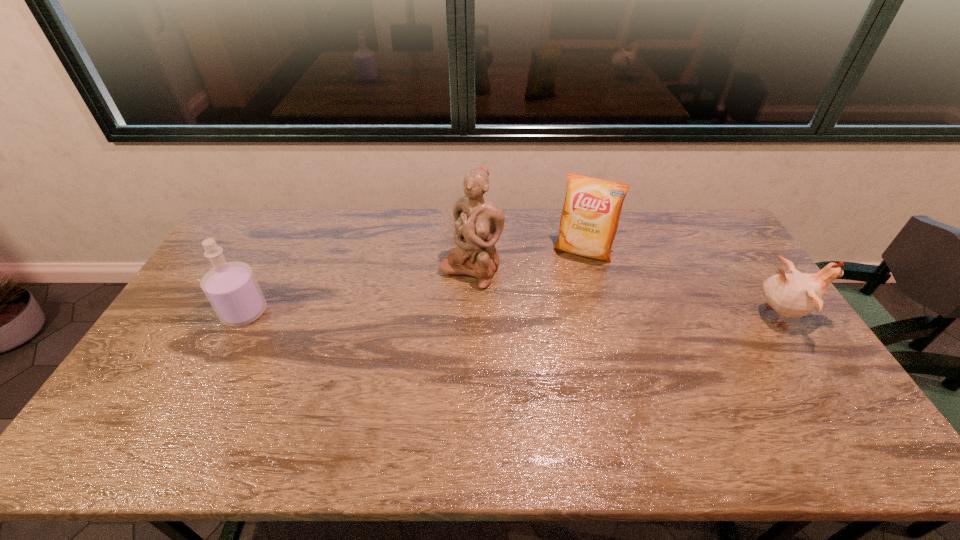
Where is `blank area at the far left corner`? blank area at the far left corner is located at coordinates (279, 218).

You are a GUI agent. You are given a task and a screenshot of the screen. Output one action in this format:
    pyautogui.click(x=<x>, y=<y>)
    Task: Click on the vacant space at the near left corner
    
    Given the screenshot: What is the action you would take?
    pyautogui.click(x=171, y=407)

The height and width of the screenshot is (540, 960). In order to click on free space at the far right corner in this screenshot , I will do `click(731, 236)`.

You are a GUI agent. You are given a task and a screenshot of the screen. Output one action in this format:
    pyautogui.click(x=<x>, y=<y>)
    Task: Click on the empty space that is in between the leftmost object and the bird
    The height and width of the screenshot is (540, 960).
    Given the screenshot: What is the action you would take?
    pyautogui.click(x=512, y=314)

The image size is (960, 540). What are the coordinates of `vacant region between the tallest object and the crisp (potato chip)` in the screenshot? It's located at (527, 261).

Where is `free spot between the bird and the crisp (potato chip)`? free spot between the bird and the crisp (potato chip) is located at coordinates (682, 284).

In order to click on unoccupied area between the crisp (potato chip) and the shortest object in this screenshot , I will do `click(682, 284)`.

You are a GUI agent. You are given a task and a screenshot of the screen. Output one action in this format:
    pyautogui.click(x=<x>, y=<y>)
    Task: Click on the vacant area that lies between the third object from right to left and the second object from right to left
    
    Given the screenshot: What is the action you would take?
    pyautogui.click(x=527, y=261)

Where is `free space between the tallest object and the perfume`? free space between the tallest object and the perfume is located at coordinates (358, 291).

Identify the location of empty location between the perfume and the crisp (potato chip). This screenshot has height=540, width=960. (414, 282).